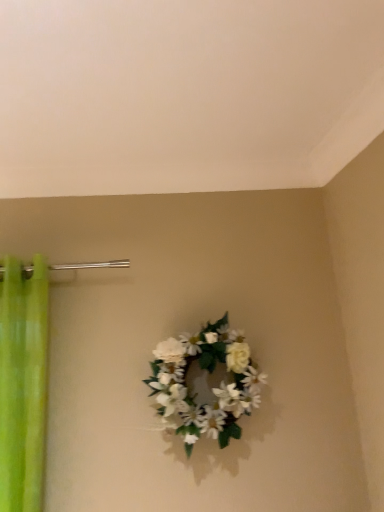
This screenshot has width=384, height=512. What do you see at coordinates (206, 383) in the screenshot?
I see `white artificial wreath at center` at bounding box center [206, 383].

Identify the location of white artificial wreath at center. (206, 383).

Locate an element on the screen. white artificial wreath at center is located at coordinates (206, 383).